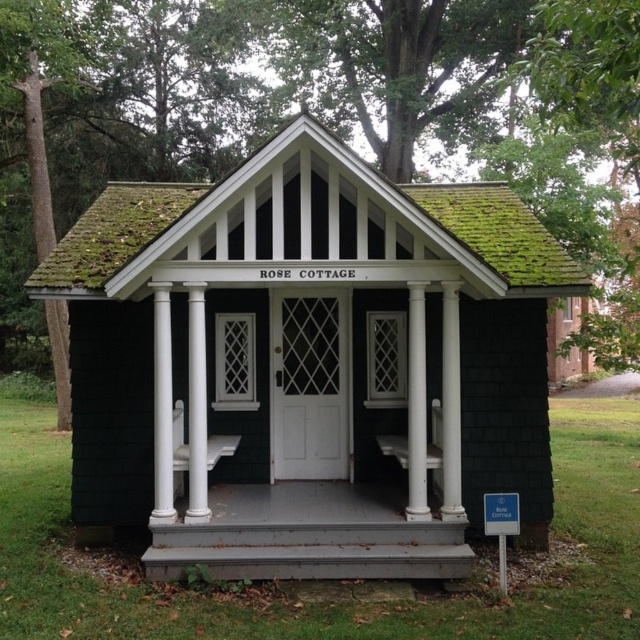
Question: Is black shingle cottage at center to the left of gray wood porch at center from the viewer's perspective?

Choices:
 (A) no
 (B) yes

Answer: (B)

Question: Among these points, which one is nearest to the camera?

Choices:
 (A) (177, 572)
 (B) (225, 541)

Answer: (A)

Question: Which point is farther from the camera taking this photo?

Choices:
 (A) (444, 568)
 (B) (342, 541)

Answer: (B)

Question: Where is black shingle cottage at center located in relation to gray wood porch at center in the image?

Choices:
 (A) right
 (B) left

Answer: (B)

Question: Is black shingle cottage at center positioned before gray wood porch at center?

Choices:
 (A) no
 (B) yes

Answer: (A)